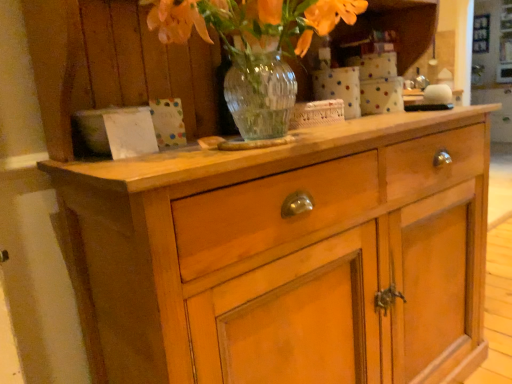
The width and height of the screenshot is (512, 384). Describe the element at coordinates (286, 256) in the screenshot. I see `wooden cabinet at center` at that location.

Locate an element on the screen. wooden cabinet at center is located at coordinates (286, 256).

This screenshot has height=384, width=512. What do you see at coordinates (252, 28) in the screenshot?
I see `translucent glass vase at upper center` at bounding box center [252, 28].

The width and height of the screenshot is (512, 384). I want to click on translucent glass vase at upper center, so click(252, 28).

Where is `wooden cabinet at center`? Image resolution: width=512 pixels, height=384 pixels. wooden cabinet at center is located at coordinates pyautogui.click(x=286, y=256).

Which object is positioned more to the left, wooden cabinet at center or translucent glass vase at upper center?

From the viewer's perspective, translucent glass vase at upper center appears more on the left side.

Consider the image. Which is behind, wooden cabinet at center or translucent glass vase at upper center?

translucent glass vase at upper center is behind.

Is point (105, 332) closer or farther from the camera than point (223, 28)?

Point (105, 332).

From the image's perspective, which one is positioned higher, wooden cabinet at center or translucent glass vase at upper center?

translucent glass vase at upper center, from the image's perspective.

From a real-world perspective, is wooden cabinet at center positioned above or below translucent glass vase at upper center?

In terms of real-world spatial position, wooden cabinet at center is below translucent glass vase at upper center.

In the scene shown: Considering the relative sizes of wooden cabinet at center and translucent glass vase at upper center in the image provided, is wooden cabinet at center wider than translucent glass vase at upper center?

Yes, wooden cabinet at center is wider than translucent glass vase at upper center.

Can you confirm if wooden cabinet at center is taller than translucent glass vase at upper center?

Yes, wooden cabinet at center is taller than translucent glass vase at upper center.

Does wooden cabinet at center have a smaller size compared to translucent glass vase at upper center?

Actually, wooden cabinet at center might be larger than translucent glass vase at upper center.

Is wooden cabinet at center situated inside translucent glass vase at upper center or outside?

wooden cabinet at center is not enclosed by translucent glass vase at upper center.

Is wooden cabinet at center with translucent glass vase at upper center?

There is a gap between wooden cabinet at center and translucent glass vase at upper center.

Could you tell me if wooden cabinet at center is turned towards translucent glass vase at upper center?

Yes, wooden cabinet at center faces towards translucent glass vase at upper center.

How different are the orientations of wooden cabinet at center and translucent glass vase at upper center in degrees?

There is a 0.0603-degree angle between the facing directions of wooden cabinet at center and translucent glass vase at upper center.

Locate an element on the screen. floral arrangement lying on the left of wooden cabinet at center is located at coordinates (252, 28).

Would you say translucent glass vase at upper center is to the left or to the right of wooden cabinet at center in the picture?

In the image, translucent glass vase at upper center appears on the left side of wooden cabinet at center.

Looking at this image, in the image, is translucent glass vase at upper center positioned in front of or behind wooden cabinet at center?

Visually, translucent glass vase at upper center is located behind wooden cabinet at center.

Which is farther from the camera, (x=216, y=14) or (x=373, y=148)?

The point (x=373, y=148) is more distant.

From the image's perspective, is translucent glass vase at upper center positioned above or below wooden cabinet at center?

translucent glass vase at upper center is above wooden cabinet at center.

In the scene shown: From a real-world perspective, between translucent glass vase at upper center and wooden cabinet at center, who is vertically lower?

wooden cabinet at center.

Considering the relative sizes of translucent glass vase at upper center and wooden cabinet at center in the image provided, is translucent glass vase at upper center wider than wooden cabinet at center?

Incorrect, the width of translucent glass vase at upper center does not surpass that of wooden cabinet at center.

Considering the sizes of translucent glass vase at upper center and wooden cabinet at center in the image, is translucent glass vase at upper center taller or shorter than wooden cabinet at center?

Clearly, translucent glass vase at upper center is shorter compared to wooden cabinet at center.

Between translucent glass vase at upper center and wooden cabinet at center, which one has smaller size?

With smaller size is translucent glass vase at upper center.

Is translucent glass vase at upper center surrounding wooden cabinet at center?

Actually, wooden cabinet at center is outside translucent glass vase at upper center.

Is translucent glass vase at upper center placed right next to wooden cabinet at center?

There is a gap between translucent glass vase at upper center and wooden cabinet at center.

Is wooden cabinet at center at the back of translucent glass vase at upper center?

That's right, translucent glass vase at upper center is facing away from wooden cabinet at center.

How many degrees apart are the facing directions of translucent glass vase at upper center and wooden cabinet at center?

0.0603 degrees.

Locate an element on the screen. The height and width of the screenshot is (384, 512). floral arrangement to the left of wooden cabinet at center is located at coordinates (252, 28).

What are the coordinates of `floral arrangement above the wooden cabinet at center (from the image's perspective)` in the screenshot? It's located at (252, 28).

Image resolution: width=512 pixels, height=384 pixels. I want to click on the chest of drawers below the translucent glass vase at upper center (from the image's perspective), so click(286, 256).